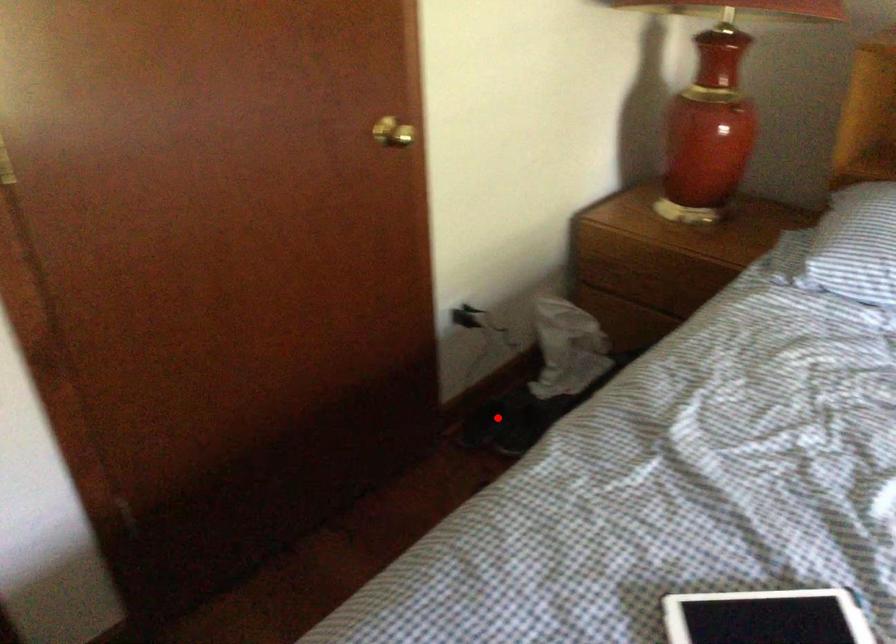
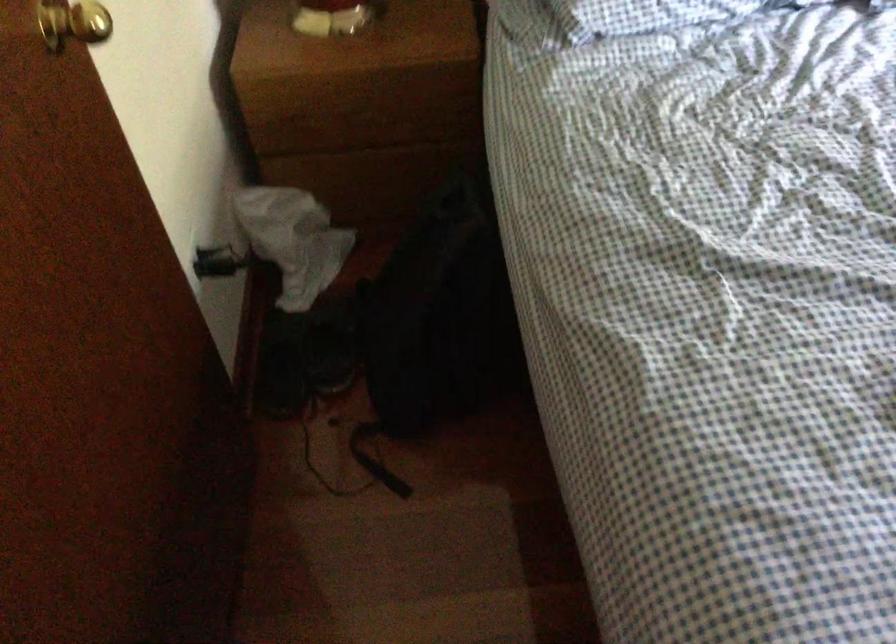
Where in the second image is the point corresponding to the highlighted location from the first image?

(282, 363)